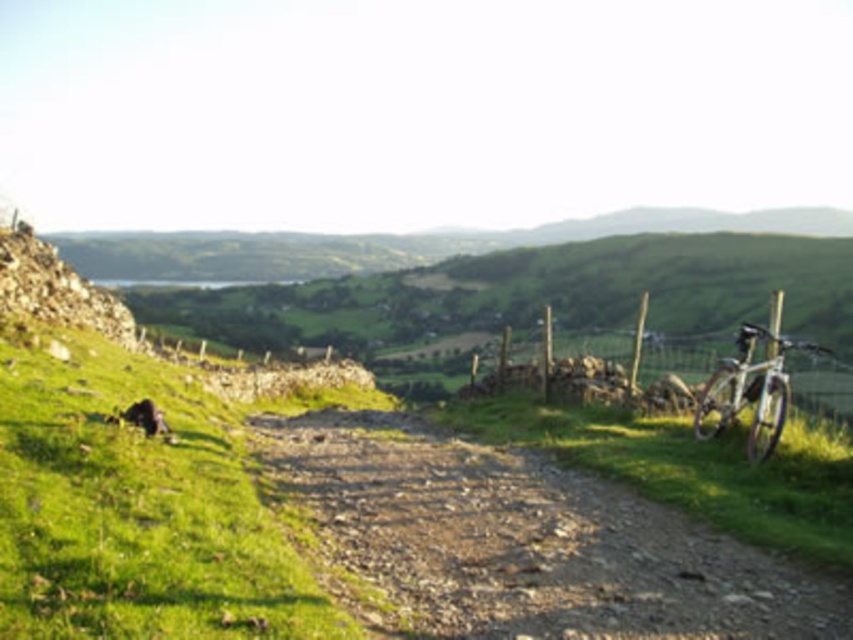
Between silver metallic mountain bike at right and fuzzy brown dog at lower left, which one is positioned lower?

Positioned lower is fuzzy brown dog at lower left.

Is silver metallic mountain bike at right further to camera compared to fuzzy brown dog at lower left?

No, silver metallic mountain bike at right is closer to the viewer.

Is point (730, 400) positioned after point (148, 422)?

Yes, point (730, 400) is behind point (148, 422).

Find the location of `silver metallic mountain bike at right`. silver metallic mountain bike at right is located at coordinates (750, 390).

Between wooden post at right and silver metallic mountain bike at right, which one appears on the left side from the viewer's perspective?

silver metallic mountain bike at right is more to the left.

Is wooden post at right shorter than silver metallic mountain bike at right?

Incorrect, wooden post at right's height does not fall short of silver metallic mountain bike at right's.

Is point (761, 428) closer to camera compared to point (753, 401)?

Yes, point (761, 428) is closer to viewer.

Where is `wooden post at right`? Image resolution: width=853 pixels, height=640 pixels. wooden post at right is located at coordinates (672, 387).

What do you see at coordinates (527, 541) in the screenshot? I see `dusty gravel path at center` at bounding box center [527, 541].

Which is in front, point (619, 620) or point (114, 420)?

Point (619, 620) is more forward.

The width and height of the screenshot is (853, 640). I want to click on dusty gravel path at center, so click(x=527, y=541).